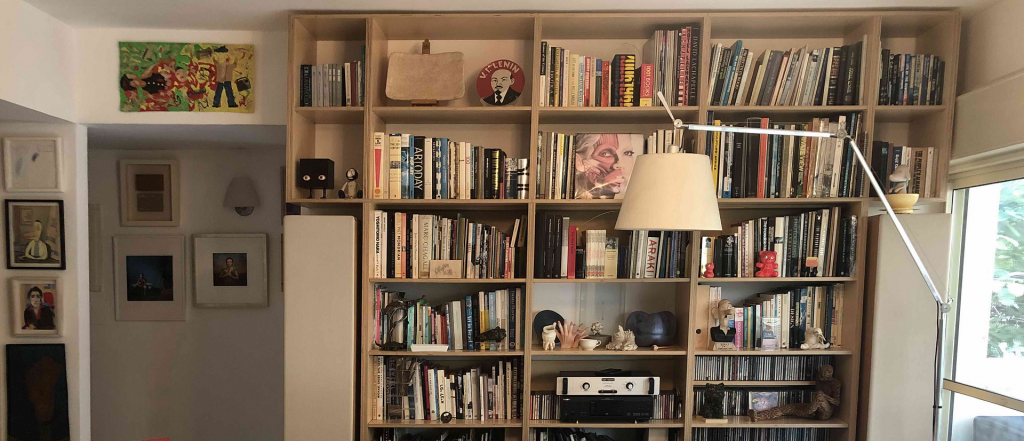
The image size is (1024, 441). Identify the location of lamp shade. (639, 193), (245, 194).